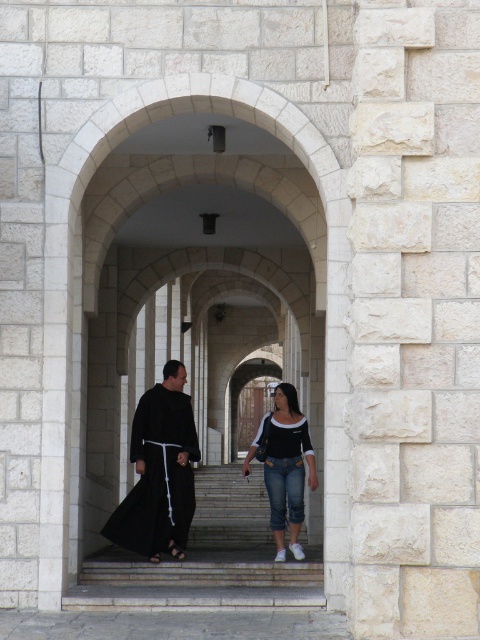
Can you confirm if black matte clothing at center is positioned to the right of black matte robe at center?

Yes, black matte clothing at center is to the right of black matte robe at center.

Is the position of black matte clothing at center less distant than that of black matte robe at center?

No, it is not.

The image size is (480, 640). In order to click on black matte clothing at center in this screenshot , I will do `click(159, 472)`.

Does point (163, 492) come closer to viewer compared to point (287, 499)?

Yes, point (163, 492) is in front of point (287, 499).

Is point (152, 454) farther from camera compared to point (292, 492)?

No, (152, 454) is in front of (292, 492).

Locate an element on the screen. Image resolution: width=480 pixels, height=640 pixels. black matte clothing at center is located at coordinates (159, 472).

Can you confirm if black matte robe at center is positioned to the left of denim jeans at center?

Indeed, black matte robe at center is positioned on the left side of denim jeans at center.

In the scene shown: Is black matte robe at center shorter than denim jeans at center?

Correct, black matte robe at center is not as tall as denim jeans at center.

Which is in front, point (178, 381) or point (268, 426)?

Point (268, 426)

The image size is (480, 640). I want to click on black matte robe at center, so click(x=159, y=472).